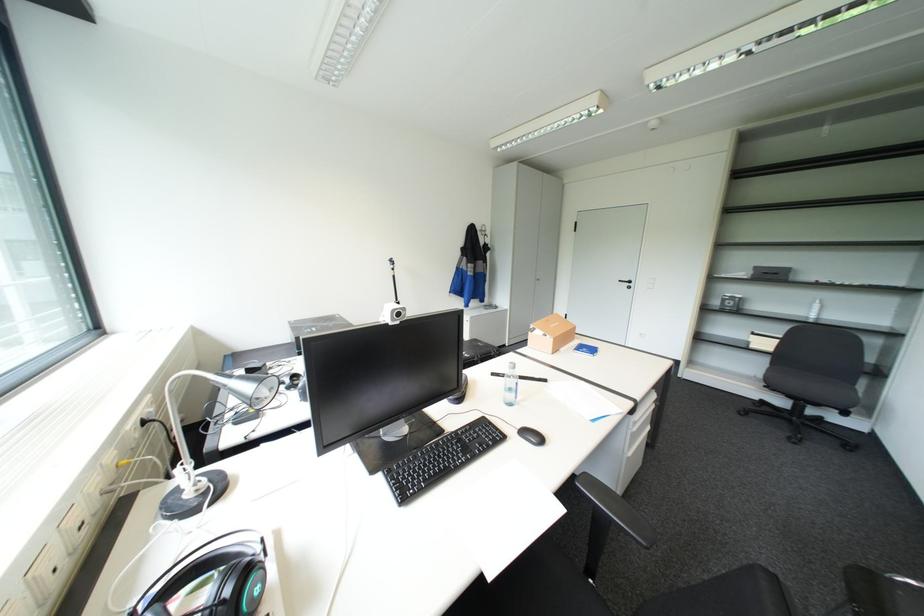
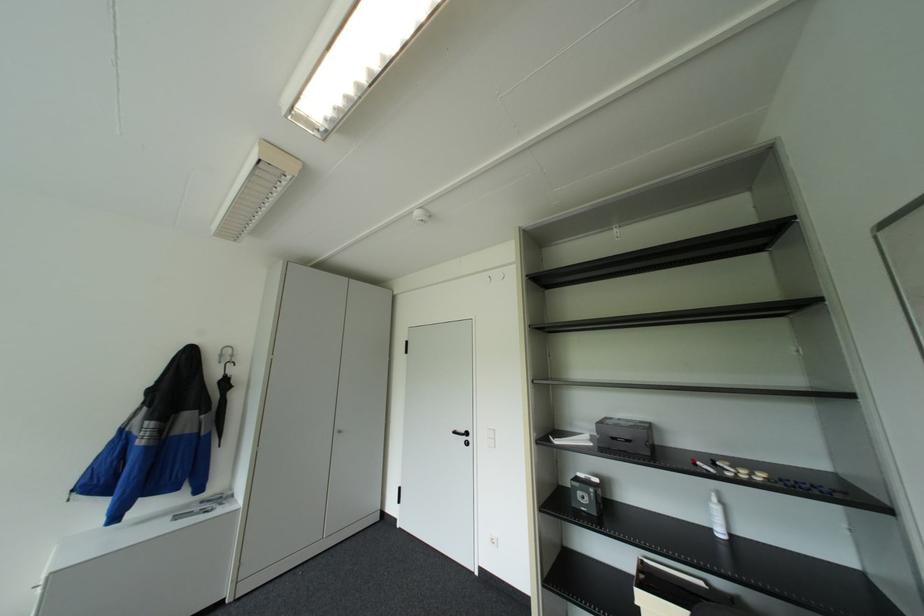
Find the pixel in the second image that matches point (825, 280) in the first image.

(702, 462)